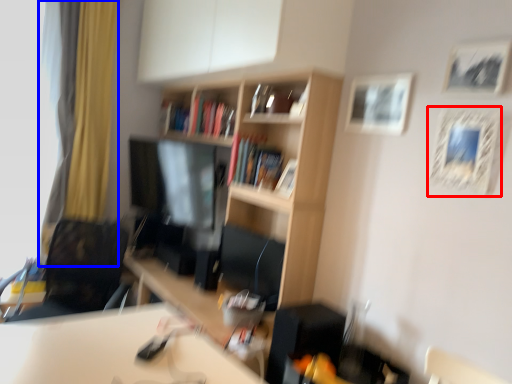
Question: Among these objects, which one is nearest to the camera, picture frame (highlighted by a red box) or curtain (highlighted by a blue box)?

Choices:
 (A) picture frame
 (B) curtain

Answer: (A)